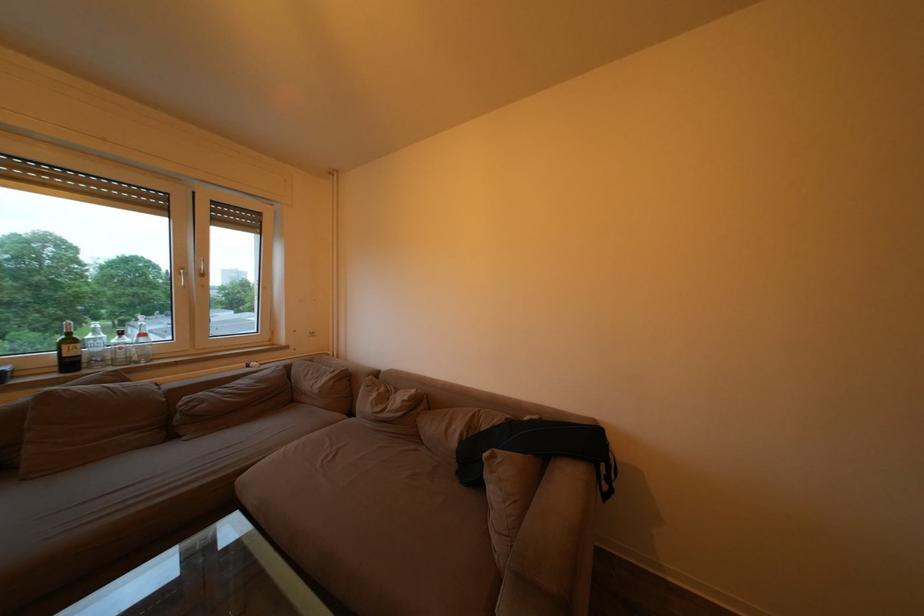
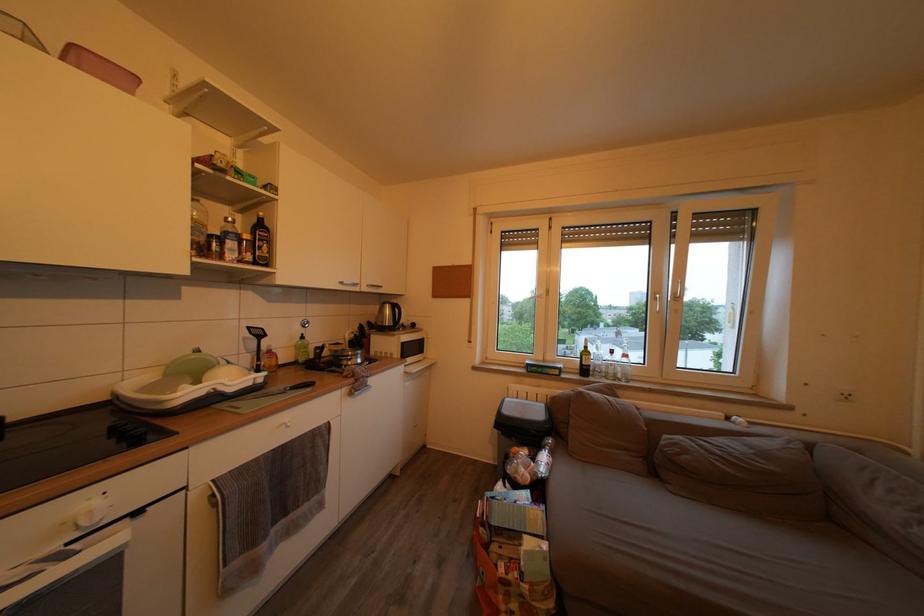
Where in the second image is the point corresponding to point (107, 355) from the first image?

(608, 369)